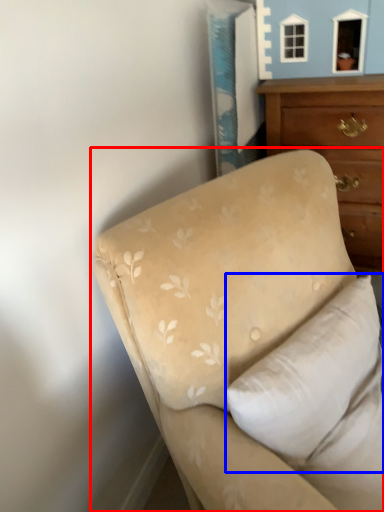
Question: Which object is closer to the camera taking this photo, studio couch (highlighted by a red box) or pillow (highlighted by a blue box)?

Choices:
 (A) studio couch
 (B) pillow

Answer: (A)